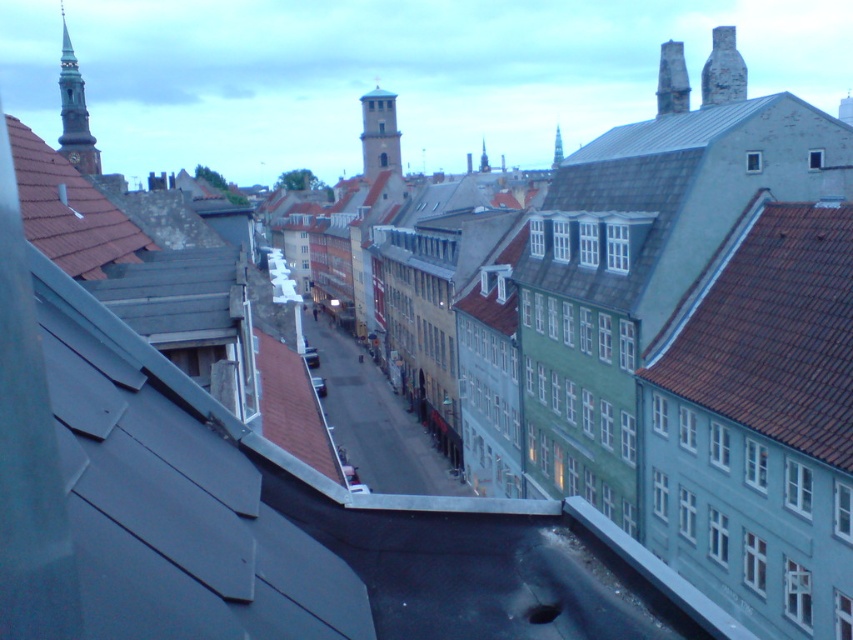
Who is higher up, brown tiled roof at center-right or red tile roof at upper left?

red tile roof at upper left

Who is more forward, (796,268) or (68,205)?

Positioned in front is point (68,205).

You are a GUI agent. You are given a task and a screenshot of the screen. Output one action in this format:
    pyautogui.click(x=<x>, y=<y>)
    Task: Click on the brown tiled roof at center-right
    The height and width of the screenshot is (640, 853).
    Given the screenshot: What is the action you would take?
    pyautogui.click(x=776, y=333)

Looking at this image, which is more to the right, red tile roof at upper left or smooth stone tower at center?

red tile roof at upper left is more to the right.

Is red tile roof at upper left below smooth stone tower at center?

Yes, red tile roof at upper left is below smooth stone tower at center.

I want to click on red tile roof at upper left, so (x=68, y=211).

Locate an element on the screen. The width and height of the screenshot is (853, 640). red tile roof at upper left is located at coordinates (68, 211).

Does smooth stone spire at upper left lie in front of smooth stone tower at center?

Yes, smooth stone spire at upper left is closer to the viewer.

At what (x,y) coordinates should I click in order to perform the action: click on smooth stone spire at upper left. Please return your answer as a coordinate pair (x, y). This screenshot has height=640, width=853. Looking at the image, I should click on (74, 113).

Locate an element on the screen. smooth stone spire at upper left is located at coordinates (74, 113).